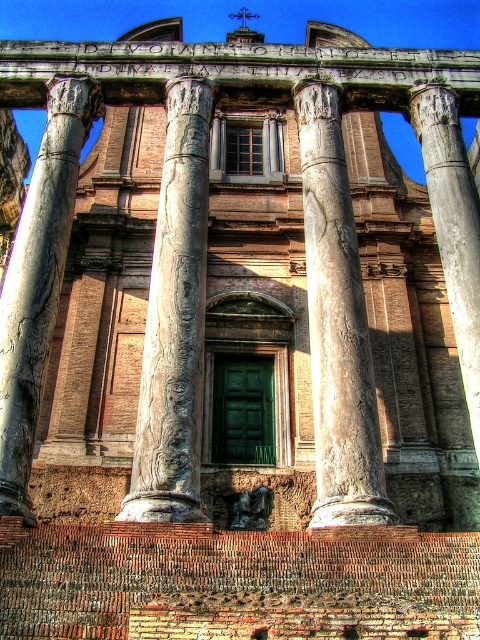
Question: Does marble column at center have a greater width compared to smooth gray column at right?

Choices:
 (A) no
 (B) yes

Answer: (A)

Question: Does marble column at center appear over marble column at left?

Choices:
 (A) no
 (B) yes

Answer: (A)

Question: Among these objects, which one is farthest from the camera?

Choices:
 (A) marble column at left
 (B) marble column at center
 (C) smooth gray column at right
 (D) carved stone column at center

Answer: (C)

Question: Can you confirm if carved stone column at center is wider than marble column at center?

Choices:
 (A) yes
 (B) no

Answer: (A)

Question: Based on their relative distances, which object is nearer to the marble column at left?

Choices:
 (A) marble column at center
 (B) smooth gray column at right
 (C) carved stone column at center

Answer: (C)

Question: Which object is farther from the camera taking this photo?

Choices:
 (A) smooth gray column at right
 (B) marble column at left
 (C) marble column at center
 (D) carved stone column at center

Answer: (A)